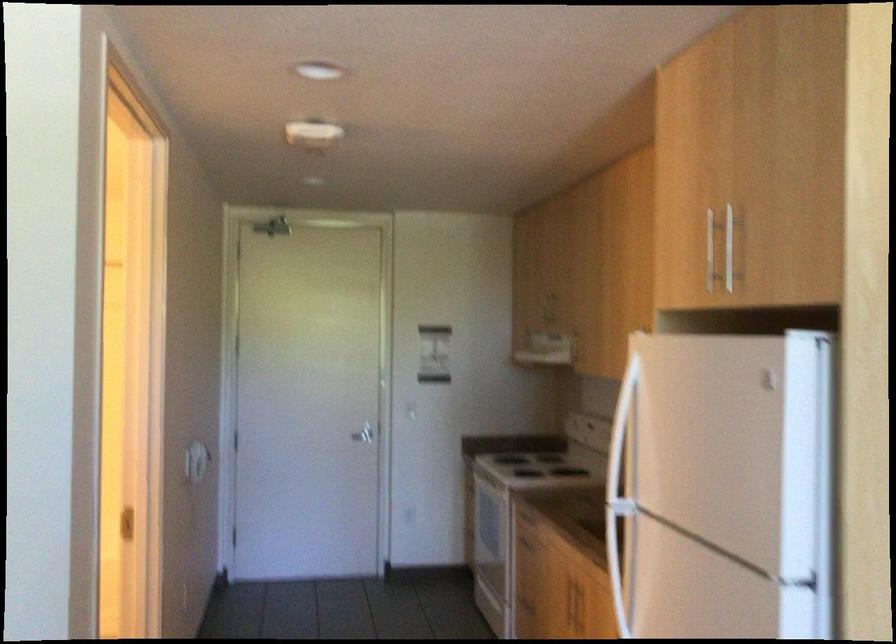
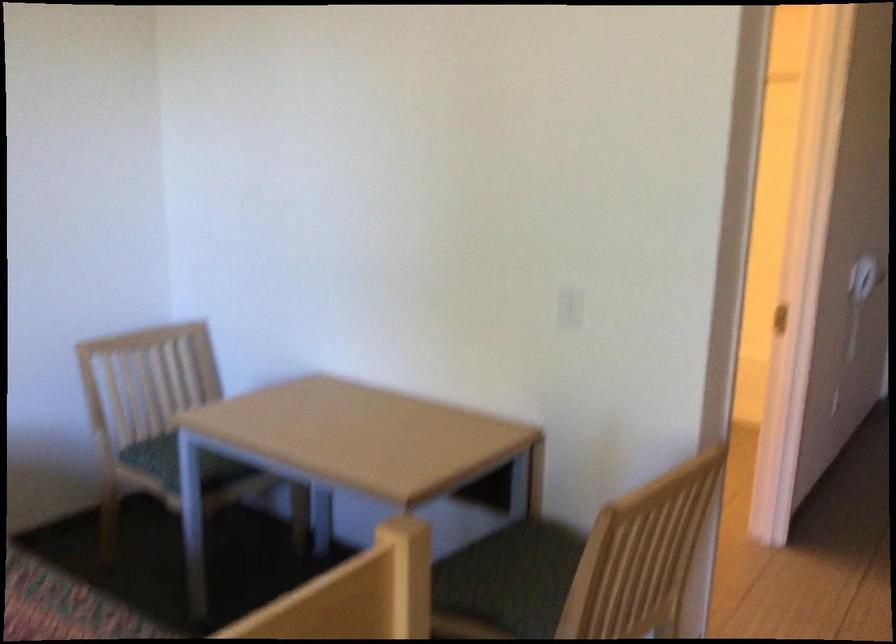
Question: The first image is from the beginning of the video and the second image is from the end. How did the camera likely rotate when shooting the video?

Choices:
 (A) Left
 (B) Right
 (C) Up
 (D) Down

Answer: (A)